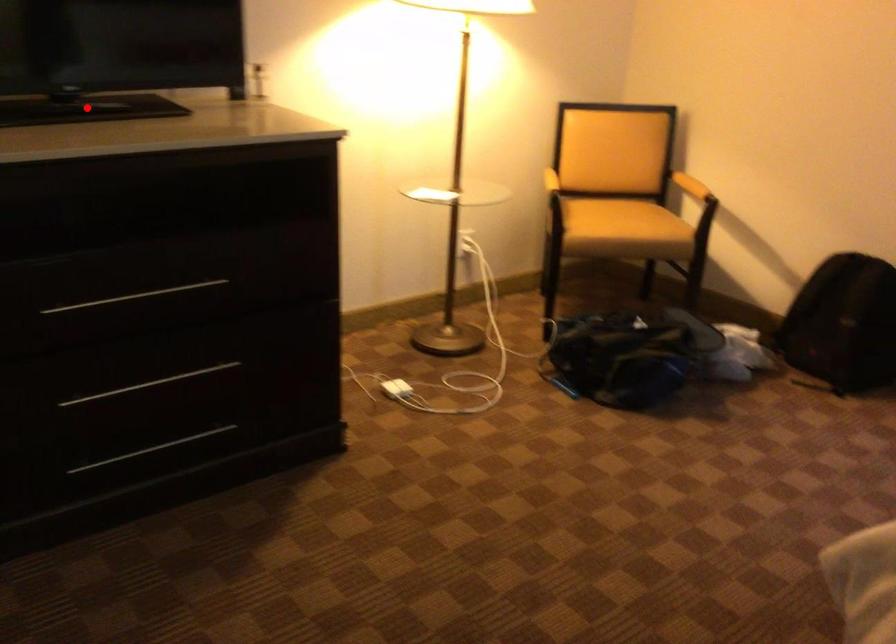
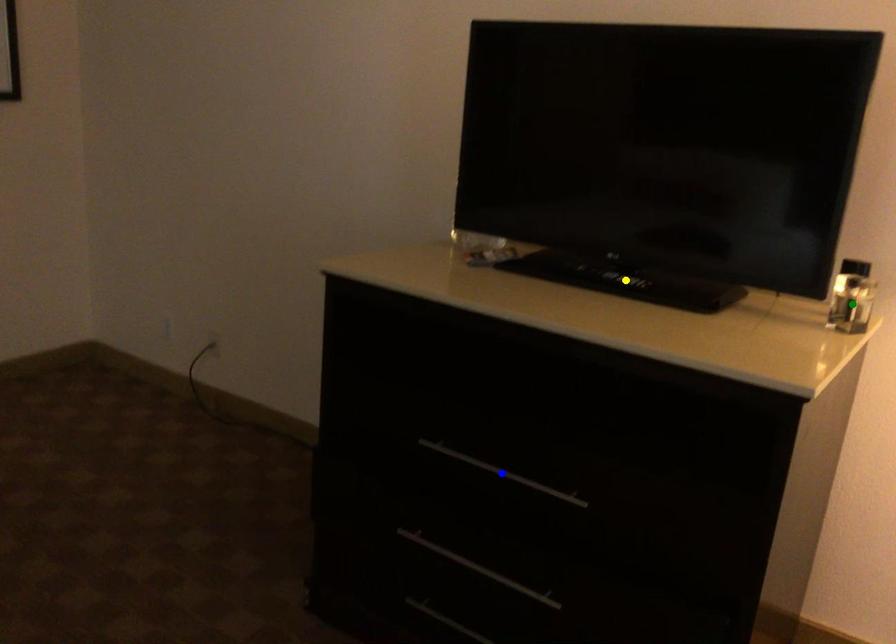
Question: I am providing you with two images of the same scene from different viewpoints. A red point is marked on the first image. You are given multiple points on the second image. Which point in image 2 represents the same 3d spot as the red point in image 1?

Choices:
 (A) yellow point
 (B) blue point
 (C) green point

Answer: (A)